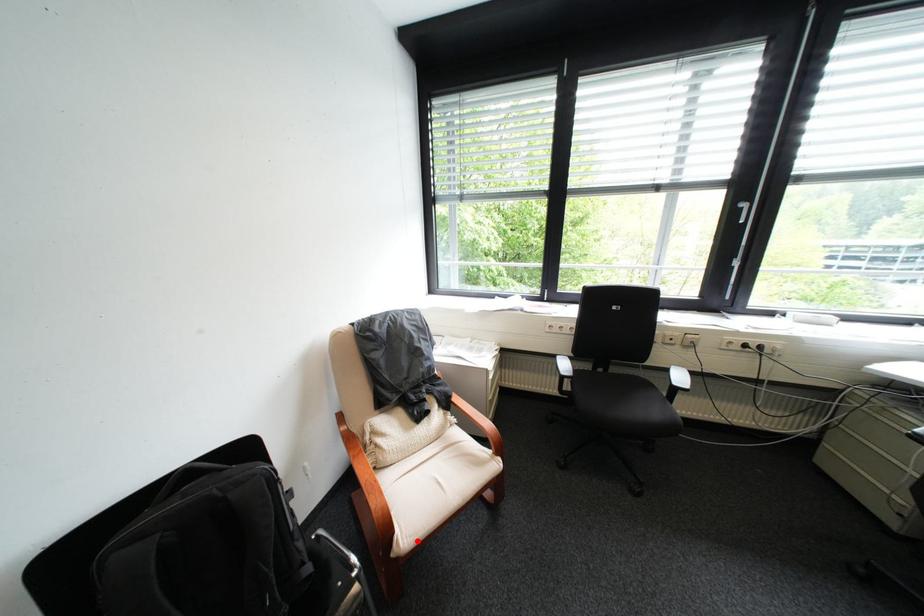
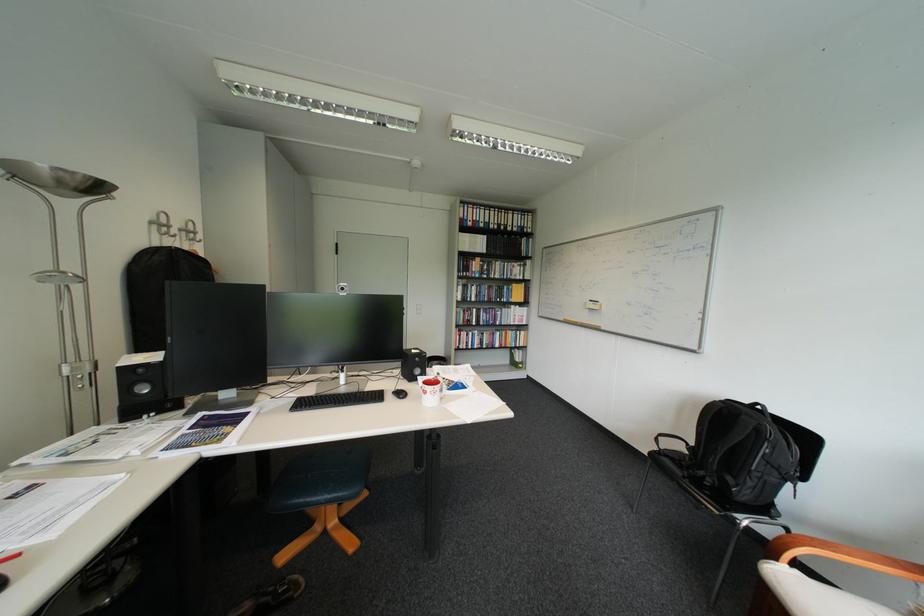
In the second image, find the point that corresponds to the highlighted location in the first image.

(783, 572)